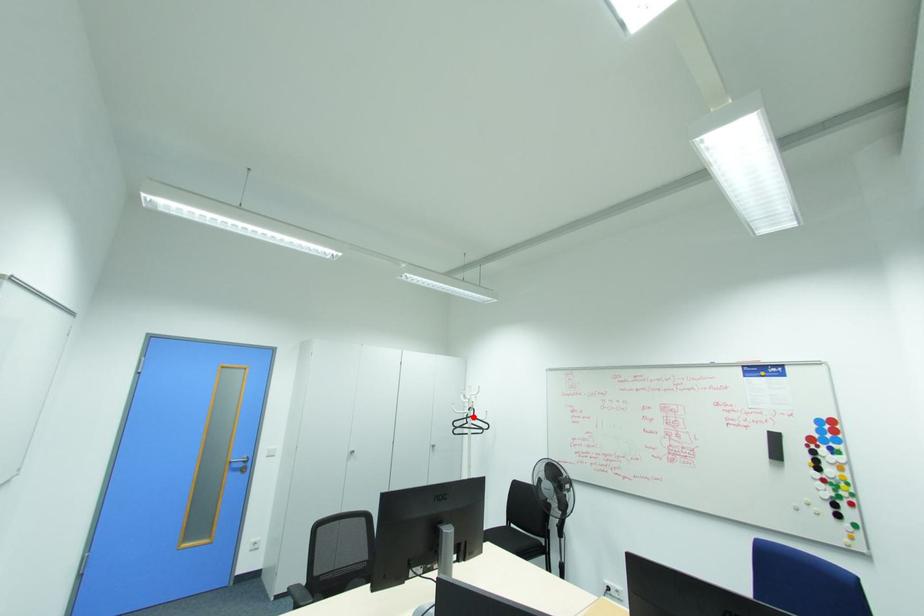
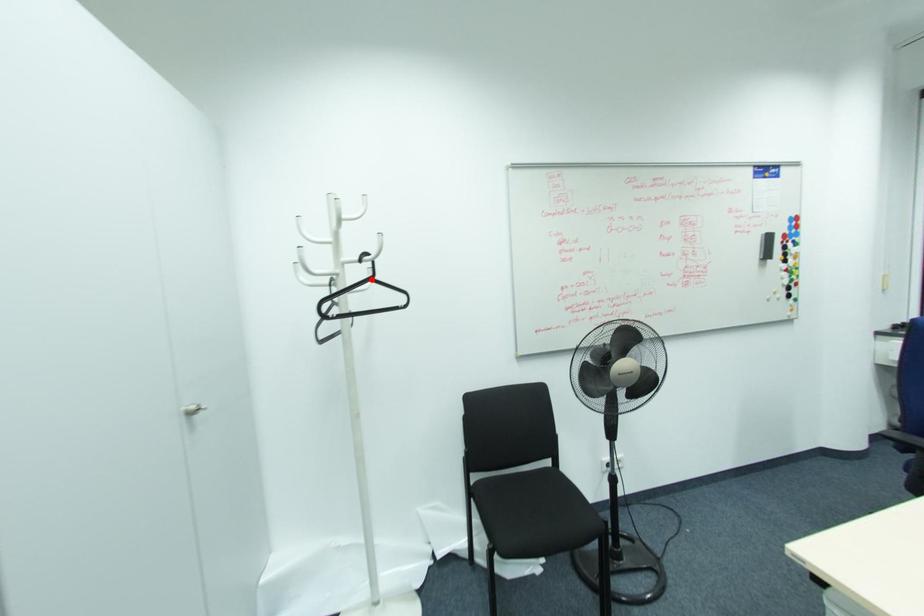
I am providing you with two images of the same scene from different viewpoints. A red point is marked on the first image and another point is marked on the second image. Is the red point in image1 aligned with the point shown in image2?

Yes